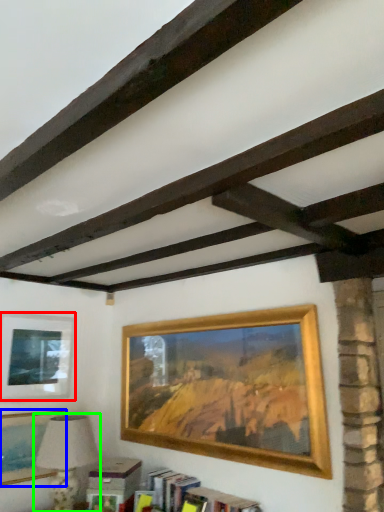
Question: Which object is positioned closest to picture frame (highlighted by a red box)? Select from picture frame (highlighted by a blue box) and table lamp (highlighted by a green box).

Choices:
 (A) picture frame
 (B) table lamp

Answer: (A)